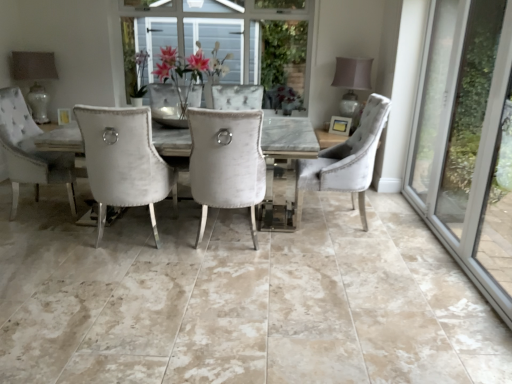
This screenshot has width=512, height=384. What are the coordinates of `vacant area in front of transparent glass door at right` in the screenshot? It's located at (441, 299).